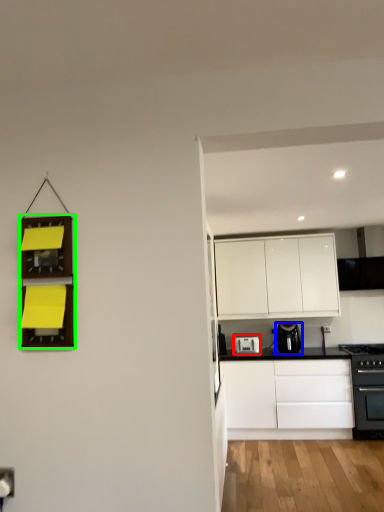
Question: Based on their relative distances, which object is nearer to kitchen appliance (highlighted by a red box)? Choose from kitchen appliance (highlighted by a blue box) and shelf (highlighted by a green box).

Choices:
 (A) kitchen appliance
 (B) shelf

Answer: (A)